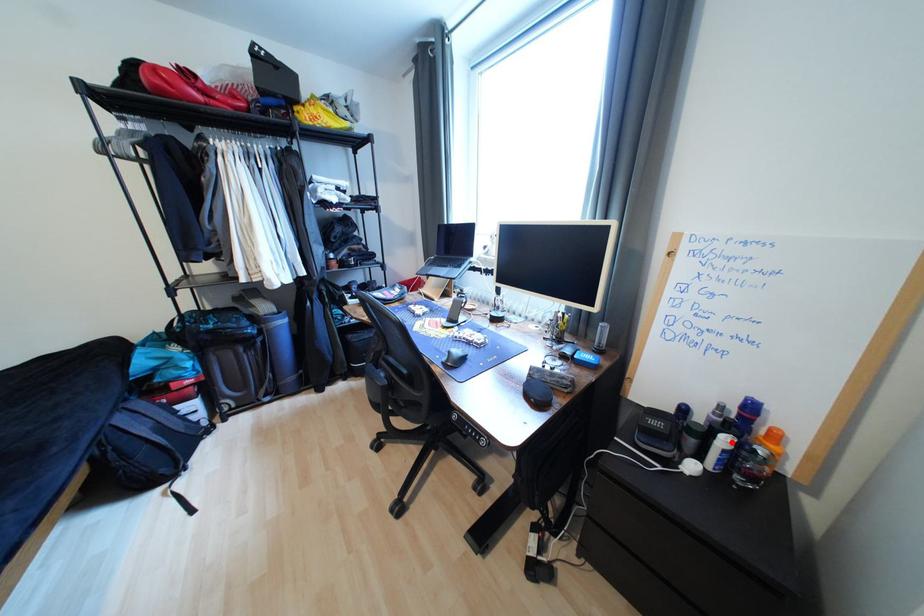
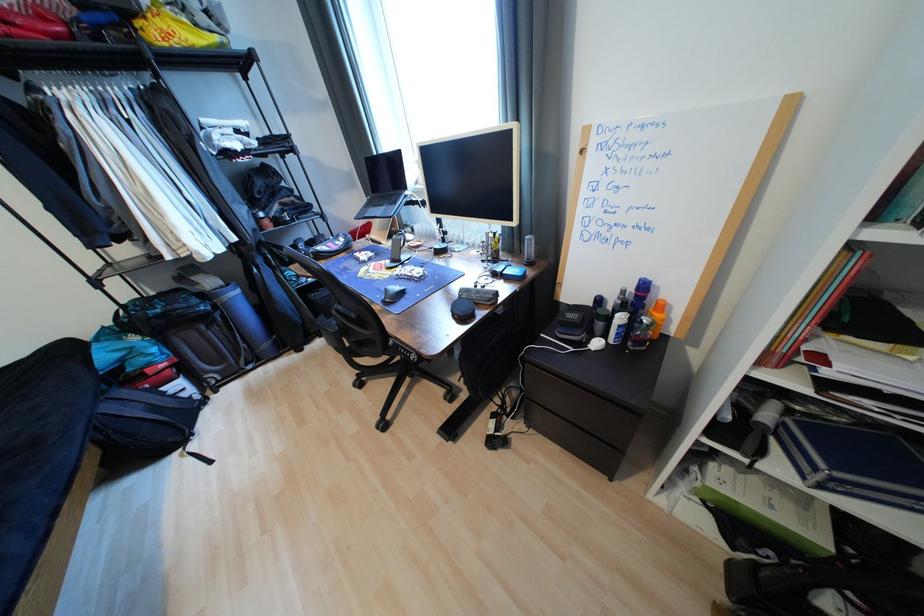
Locate, in the second image, the point that corresponds to the highlighted location in the first image.

(627, 320)